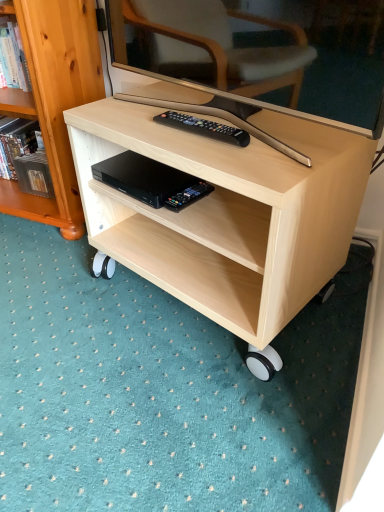
The height and width of the screenshot is (512, 384). Identify the location of vacant area located to the right-hand side of black plastic remote at center. (289, 138).